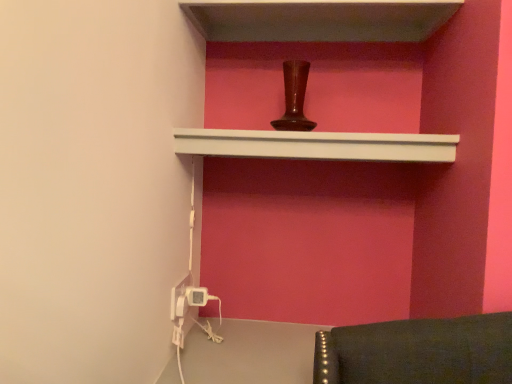
Question: Looking at their shapes, would you say smooth white shelf at upper center, which is counted as the second shelf, starting from the bottom, is wider or thinner than white plastic electric outlet at lower left, arranged as the second electric outlet when viewed from the left?

Choices:
 (A) thin
 (B) wide

Answer: (B)

Question: Based on their sizes in the image, would you say smooth white shelf at upper center, which ranks as the 1th shelf in top-to-bottom order, is bigger or smaller than white plastic electric outlet at lower left, arranged as the first electric outlet when viewed from the right?

Choices:
 (A) big
 (B) small

Answer: (A)

Question: Considering the real-world distances, which object is closest to the white matte shelf at upper center, which ranks as the second shelf in top-to-bottom order?

Choices:
 (A) smooth white shelf at upper center, which ranks as the 1th shelf in top-to-bottom order
 (B) white plastic electric outlet at lower left, which is the first electric outlet in left-to-right order
 (C) white plastic electric outlet at lower left, arranged as the second electric outlet when viewed from the left

Answer: (A)

Question: Which object is the closest to the white matte shelf at upper center, which ranks as the second shelf in top-to-bottom order?

Choices:
 (A) smooth white shelf at upper center, which ranks as the 1th shelf in top-to-bottom order
 (B) white plastic electric outlet at lower left, arranged as the second electric outlet when viewed from the left
 (C) white plastic electric outlet at lower left, which is the second electric outlet from right to left

Answer: (A)